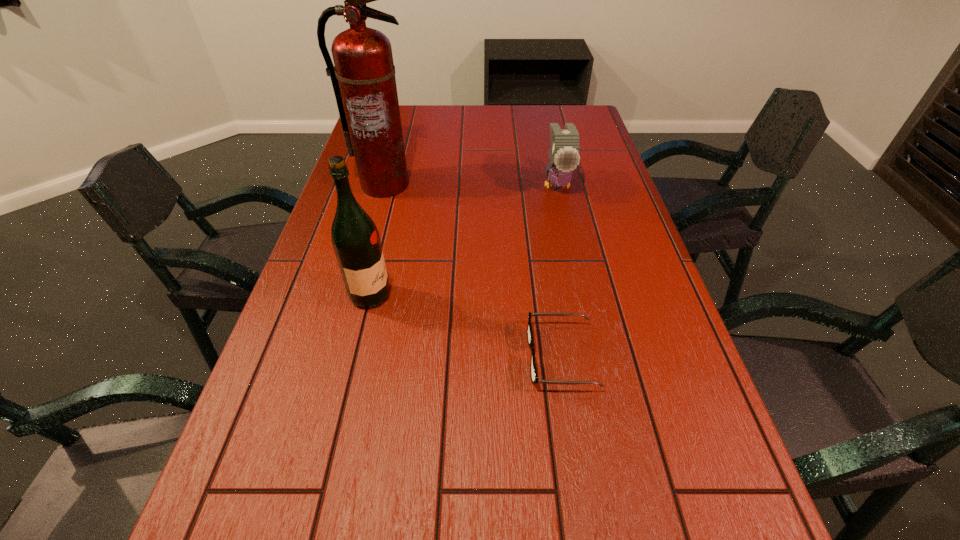
Locate an element on the screen. This screenshot has height=540, width=960. free space between the bird and the tallest object is located at coordinates (470, 184).

In order to click on blank region between the liquor and the bird in this screenshot , I will do (464, 240).

What are the coordinates of `vacant area between the bird and the spectacles` in the screenshot? It's located at (559, 270).

Where is `unoccupied area between the bird and the spectacles`? unoccupied area between the bird and the spectacles is located at coordinates (559, 270).

You are a GUI agent. You are given a task and a screenshot of the screen. Output one action in this format:
    pyautogui.click(x=<x>, y=<y>)
    Task: Click on the empty location between the nearest object and the fire extinguisher
    The width and height of the screenshot is (960, 540).
    Given the screenshot: What is the action you would take?
    pyautogui.click(x=472, y=271)

You are a GUI agent. You are given a task and a screenshot of the screen. Output one action in this format:
    pyautogui.click(x=<x>, y=<y>)
    Task: Click on the free area in between the third farthest object and the second shortest object
    This screenshot has height=540, width=960.
    Given the screenshot: What is the action you would take?
    pyautogui.click(x=464, y=240)

Where is `blank region between the shortest object and the third shortest object`? blank region between the shortest object and the third shortest object is located at coordinates (466, 326).

This screenshot has height=540, width=960. Identify the location of free space between the bird and the third farthest object. (464, 240).

Locate which object ranks in proximity to the bird. Please provide its 2D coordinates. Your answer should be formatted as a tuple, i.e. [(x, y)], where the tuple contains the x and y coordinates of a point satisfying the conditions above.

[(363, 78)]

Image resolution: width=960 pixels, height=540 pixels. I want to click on object that is the closest to the bird, so click(x=363, y=78).